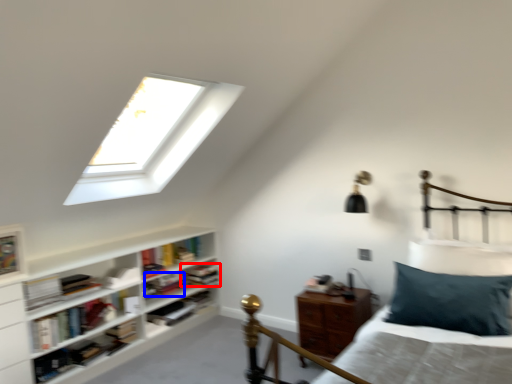
Question: Which point is further to the camera, book (highlighted by a red box) or book (highlighted by a blue box)?

Choices:
 (A) book
 (B) book

Answer: (A)